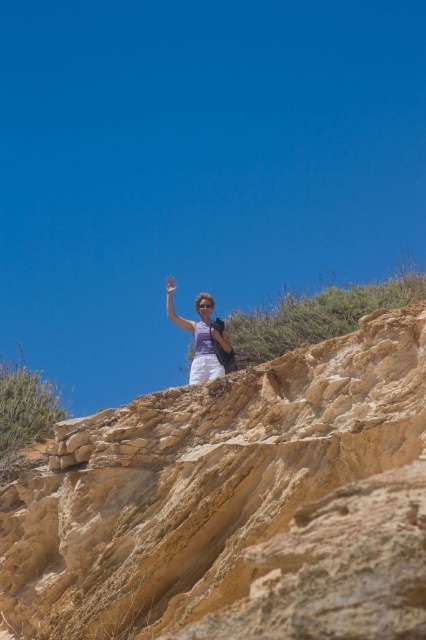
Question: Which point appears farthest from the camera in this image?

Choices:
 (A) (344, 570)
 (B) (210, 339)

Answer: (B)

Question: Does smooth sandstone cliff at upper center have a larger size compared to matte purple shirt at upper center?

Choices:
 (A) yes
 (B) no

Answer: (A)

Question: Can you confirm if smooth sandstone cliff at upper center is positioned to the right of matte purple shirt at upper center?

Choices:
 (A) no
 (B) yes

Answer: (B)

Question: Which point is farther to the camera?

Choices:
 (A) smooth sandstone cliff at upper center
 (B) matte purple shirt at upper center

Answer: (B)

Question: Does smooth sandstone cliff at upper center appear under matte purple shirt at upper center?

Choices:
 (A) yes
 (B) no

Answer: (A)